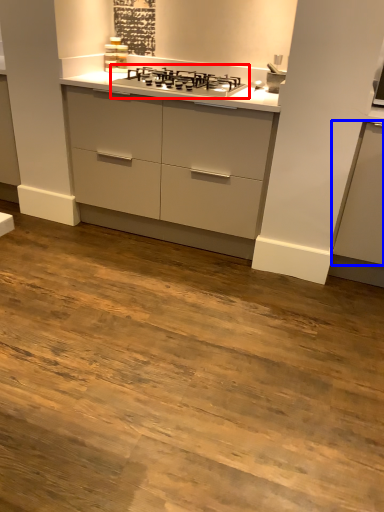
Question: Among these objects, which one is farthest to the camera, gas stove (highlighted by a red box) or cabinetry (highlighted by a blue box)?

Choices:
 (A) gas stove
 (B) cabinetry

Answer: (A)